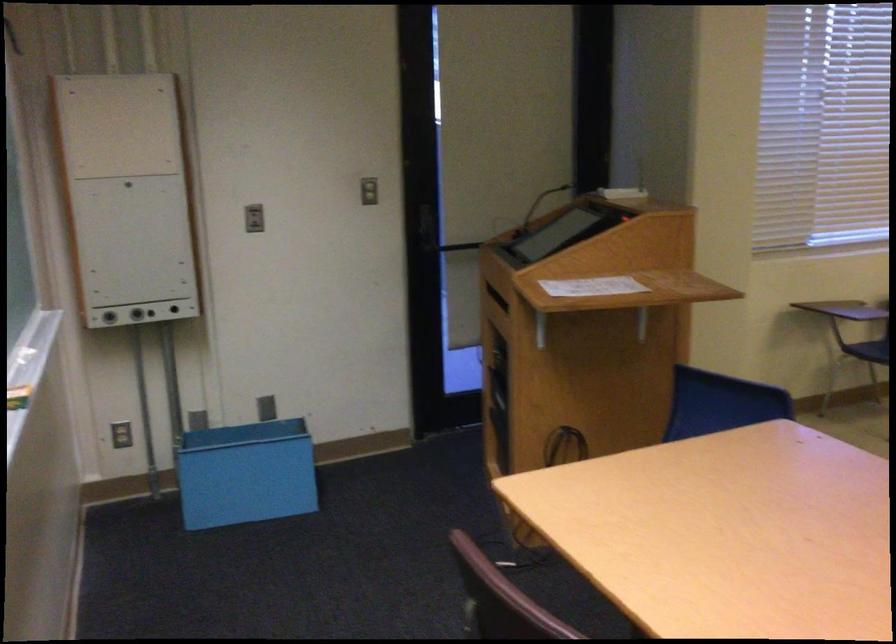
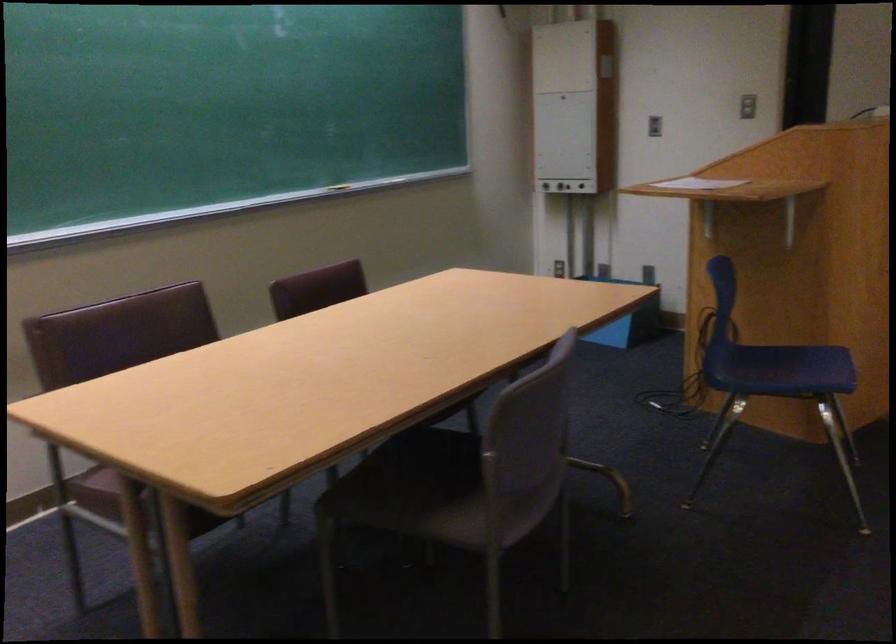
Find the pixel in the second image that matches point 261,219 in the first image.

(653, 126)